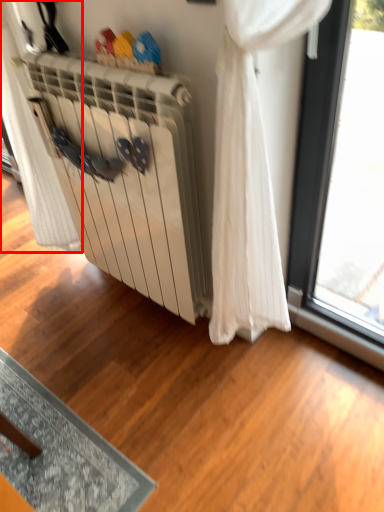
Question: From the image's perspective, what is the correct spatial relationship of curtain (annotated by the red box) in relation to radiator?

Choices:
 (A) below
 (B) above

Answer: (B)